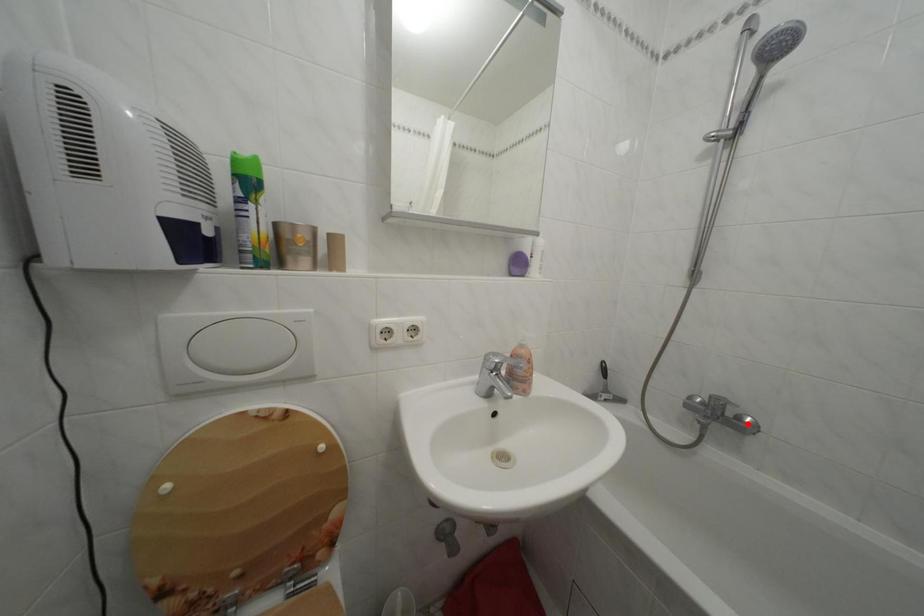
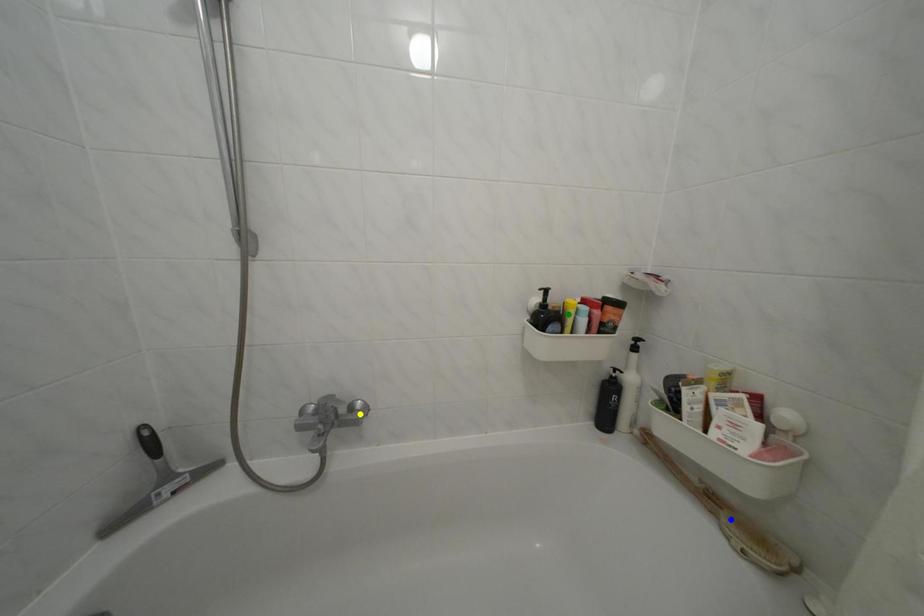
Question: I am providing you with two images of the same scene from different viewpoints. A red point is marked on the first image. You are given multiple points on the second image. Can you choose the point in image 2 that corresponds to the point in image 1?

Choices:
 (A) yellow point
 (B) green point
 (C) blue point

Answer: (A)